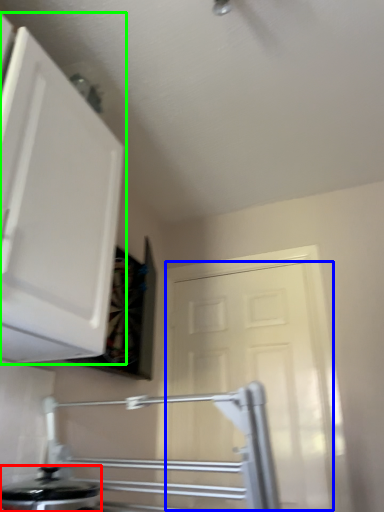
Question: Which object is the closest to the kitchen appliance (highlighted by a red box)? Choose among these: door (highlighted by a blue box) or cabinetry (highlighted by a green box).

Choices:
 (A) door
 (B) cabinetry

Answer: (B)